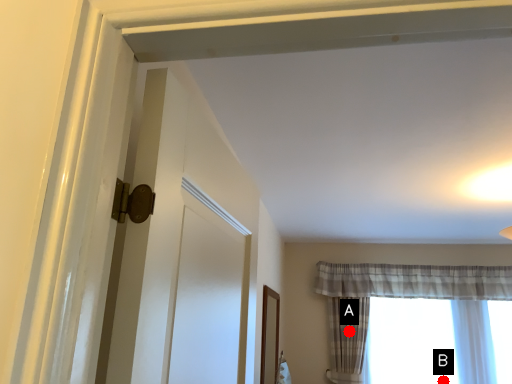
Question: Two points are circled on the image, labeled by A and B beside each circle. Which point is closer to the camera?

Choices:
 (A) A is closer
 (B) B is closer

Answer: (B)